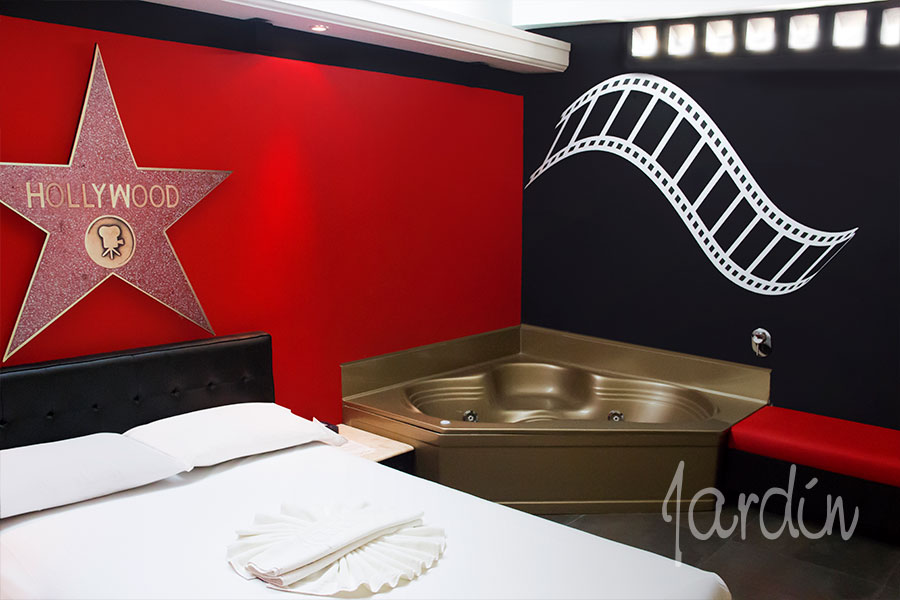
Find the location of `lights`. lights is located at coordinates (752, 41).